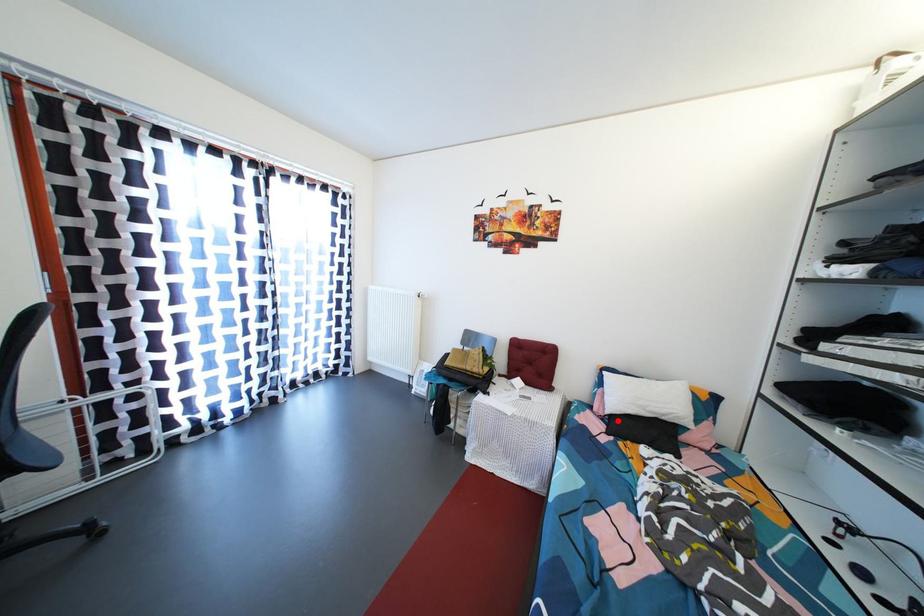
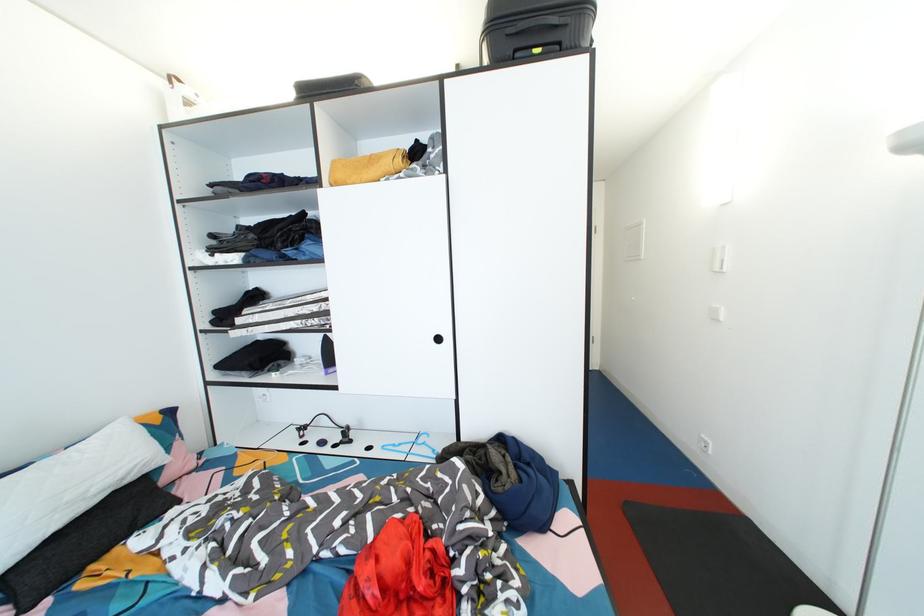
The point at the highlighted location is marked in the first image. Where is the corresponding point in the second image?

(8, 583)